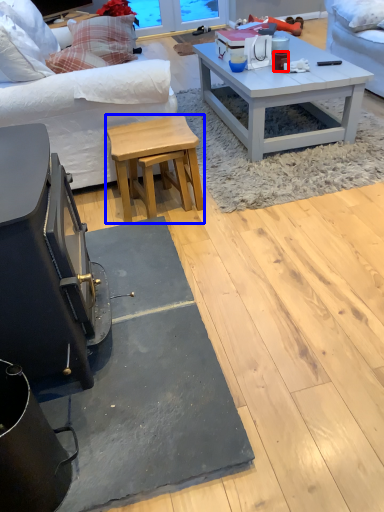
Question: Among these objects, which one is nearest to the camera, coffee cup (highlighted by a red box) or stool (highlighted by a blue box)?

Choices:
 (A) coffee cup
 (B) stool

Answer: (B)